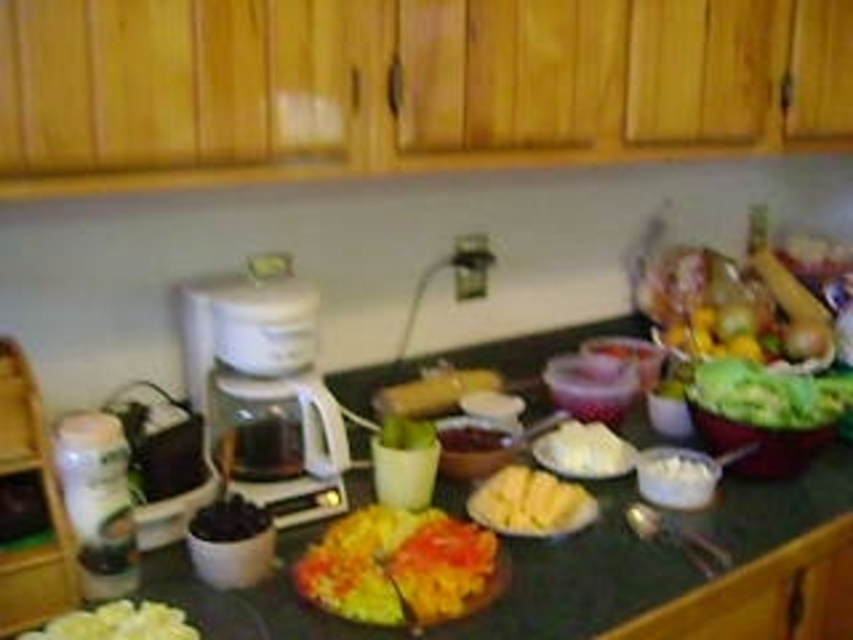
You are standing in front of the kitchen countertop and want to place a new item on the surface. You have two points marked on the countertop at coordinates point (648,548) and point (142,618). Which point is closer to you?

Point (648,548) is further to the viewer than point (142,618), so the point closer to you would be point (142,618).

You are preparing breakfast and need to arrange the yellow matte bread at lower left and the dark matte blueberries at center on the kitchen counter. Given their sizes, which item would require more space to place properly?

The dark matte blueberries at center require more space because they occupy more space than the yellow matte bread at lower left according to the description.